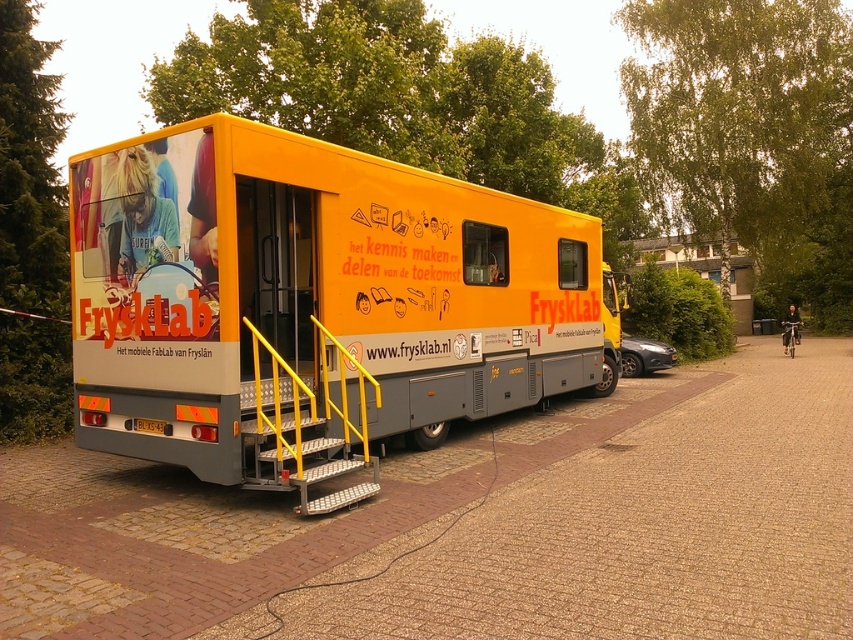
Who is positioned more to the left, yellow matte truck at center or matte black car at center-right?

yellow matte truck at center is more to the left.

Does point (73, 321) come farther from viewer compared to point (662, 356)?

No, it is not.

Is point (172, 381) less distant than point (654, 346)?

Yes, it is in front of point (654, 346).

This screenshot has width=853, height=640. What are the coordinates of `yellow matte truck at center` in the screenshot? It's located at (314, 305).

Is matte yellow advertisement at center above matte black car at center-right?

Yes.

Measure the distance between point (114, 184) and camera.

The distance of point (114, 184) from camera is 6.95 meters.

Who is more distant from viewer, (163, 237) or (660, 364)?

Positioned behind is point (660, 364).

Locate an element on the screen. The width and height of the screenshot is (853, 640). matte yellow advertisement at center is located at coordinates (144, 241).

What do you see at coordinates (314, 305) in the screenshot? I see `yellow matte truck at center` at bounding box center [314, 305].

Which is more to the right, yellow matte truck at center or matte yellow advertisement at center?

yellow matte truck at center is more to the right.

What do you see at coordinates (314, 305) in the screenshot? I see `yellow matte truck at center` at bounding box center [314, 305].

Locate an element on the screen. Image resolution: width=853 pixels, height=640 pixels. yellow matte truck at center is located at coordinates (314, 305).